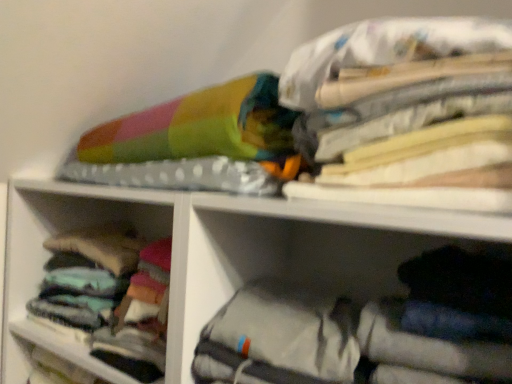
Question: Is soft cotton socks at left, placed as the 2th cabinet when sorted from right to left, placed right next to gray fabric bag at lower right, placed as the first cabinet when sorted from right to left?

Choices:
 (A) no
 (B) yes

Answer: (A)

Question: Is soft cotton socks at left, arranged as the 2th cabinet when viewed from the front, not close to gray fabric bag at lower right, the 2th cabinet when ordered from left to right?

Choices:
 (A) yes
 (B) no

Answer: (B)

Question: Considering the relative sizes of soft cotton socks at left, the first cabinet positioned from the left, and gray fabric bag at lower right, the 2th cabinet when ordered from left to right, in the image provided, is soft cotton socks at left, the first cabinet positioned from the left, thinner than gray fabric bag at lower right, the 2th cabinet when ordered from left to right,?

Choices:
 (A) no
 (B) yes

Answer: (A)

Question: Is soft cotton socks at left, placed as the 2th cabinet when sorted from right to left, bigger than gray fabric bag at lower right, the 2th cabinet when ordered from left to right?

Choices:
 (A) no
 (B) yes

Answer: (A)

Question: Is soft cotton socks at left, the 1th cabinet viewed from the back, taller than gray fabric bag at lower right, placed as the first cabinet when sorted from right to left?

Choices:
 (A) yes
 (B) no

Answer: (A)

Question: From the image's perspective, relative to soft cotton socks at left, arranged as the 2th cabinet when viewed from the front, is gray fabric bag at lower right, positioned as the first cabinet in front-to-back order, above or below?

Choices:
 (A) above
 (B) below

Answer: (B)

Question: Considering their positions, is gray fabric bag at lower right, positioned as the first cabinet in front-to-back order, located in front of or behind soft cotton socks at left, the first cabinet positioned from the left?

Choices:
 (A) front
 (B) behind

Answer: (A)

Question: Is gray fabric bag at lower right, positioned as the first cabinet in front-to-back order, inside or outside of soft cotton socks at left, arranged as the 2th cabinet when viewed from the front?

Choices:
 (A) inside
 (B) outside

Answer: (B)

Question: Considering the positions of gray fabric bag at lower right, the second cabinet from the back, and soft cotton socks at left, arranged as the 2th cabinet when viewed from the front, in the image, is gray fabric bag at lower right, the second cabinet from the back, wider or thinner than soft cotton socks at left, arranged as the 2th cabinet when viewed from the front,?

Choices:
 (A) wide
 (B) thin

Answer: (B)

Question: From the image's perspective, is multicolored fabric at upper right positioned above or below soft cotton socks at left, placed as the 2th cabinet when sorted from right to left?

Choices:
 (A) above
 (B) below

Answer: (A)

Question: Is multicolored fabric at upper right inside or outside of soft cotton socks at left, the first cabinet positioned from the left?

Choices:
 (A) inside
 (B) outside

Answer: (B)

Question: From their relative heights in the image, would you say multicolored fabric at upper right is taller or shorter than soft cotton socks at left, the 1th cabinet viewed from the back?

Choices:
 (A) tall
 (B) short

Answer: (A)

Question: Does point (505, 36) appear closer or farther from the camera than point (126, 192)?

Choices:
 (A) farther
 (B) closer

Answer: (B)

Question: In the image, is soft cotton socks at left, the first cabinet positioned from the left, positioned in front of or behind multicolored fabric at upper right?

Choices:
 (A) behind
 (B) front

Answer: (A)

Question: Is soft cotton socks at left, placed as the 2th cabinet when sorted from right to left, to the left or to the right of multicolored fabric at upper right in the image?

Choices:
 (A) right
 (B) left

Answer: (B)